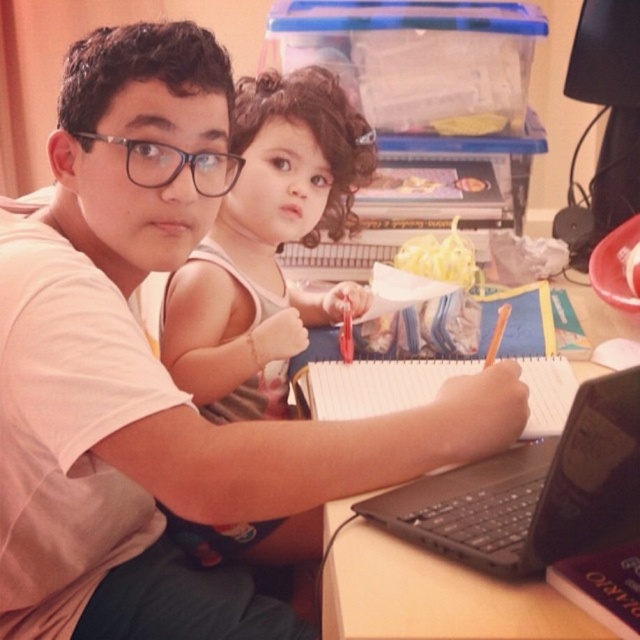
Question: Can you confirm if smooth beige tank top at upper center is positioned below wooden table at center?

Choices:
 (A) yes
 (B) no

Answer: (B)

Question: Can you confirm if smooth beige tank top at upper center is positioned below wooden table at center?

Choices:
 (A) no
 (B) yes

Answer: (A)

Question: Which object is the farthest from the smooth beige tank top at upper center?

Choices:
 (A) black plastic laptop at center
 (B) wooden table at center

Answer: (A)

Question: Which object is positioned closest to the black plastic laptop at center?

Choices:
 (A) smooth beige tank top at upper center
 (B) wooden table at center

Answer: (B)

Question: Is black plastic laptop at center thinner than wooden table at center?

Choices:
 (A) no
 (B) yes

Answer: (A)

Question: Which of these objects is positioned farthest from the wooden table at center?

Choices:
 (A) black plastic laptop at center
 (B) smooth beige tank top at upper center

Answer: (B)